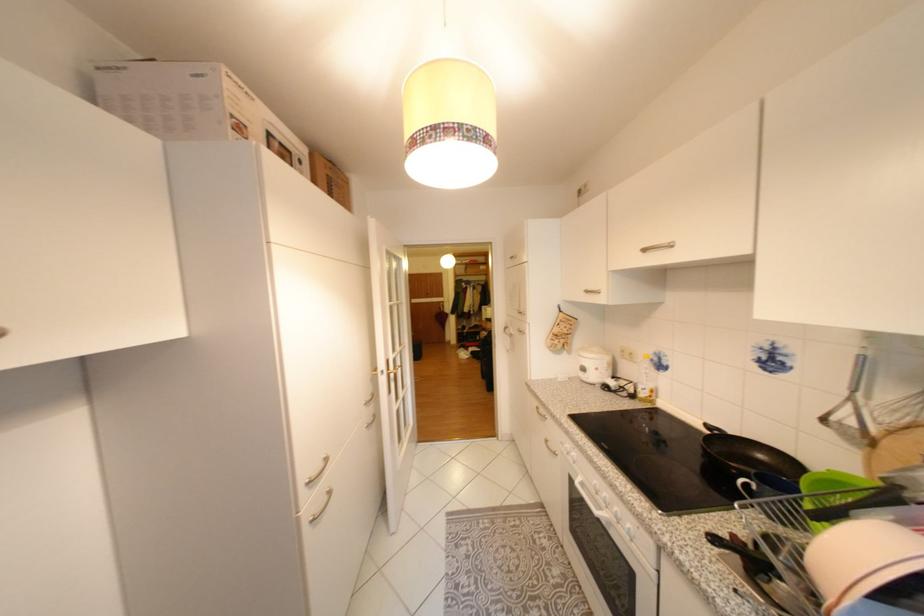
Describe the element at coordinates (394, 370) in the screenshot. Image resolution: width=924 pixels, height=616 pixels. I see `the gold door handle` at that location.